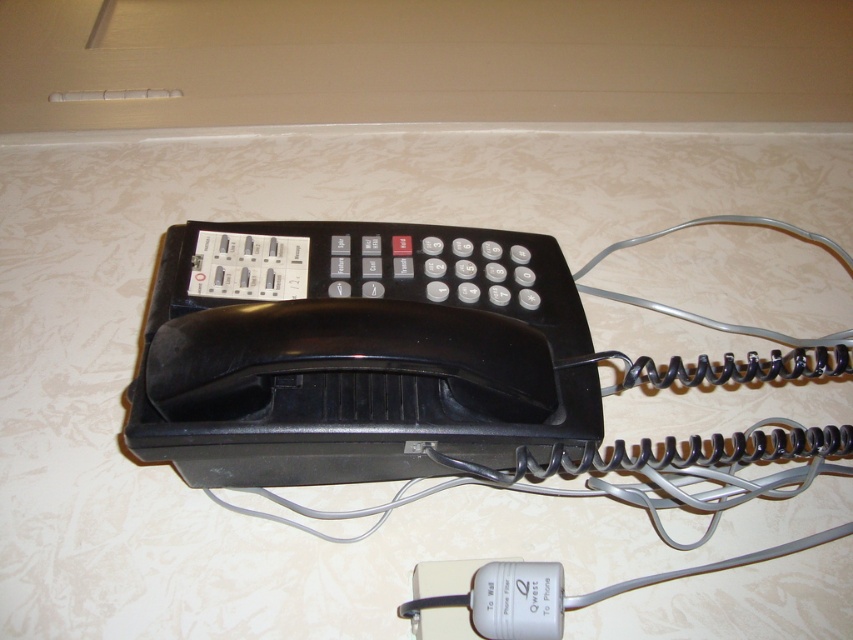
How far apart are black plastic phone at center and white plastic power filter at lower center?

black plastic phone at center is 7.97 inches from white plastic power filter at lower center.

Who is more distant from viewer, (310, 344) or (555, 563)?

The point (555, 563) is behind.

I want to click on black plastic phone at center, so click(x=358, y=353).